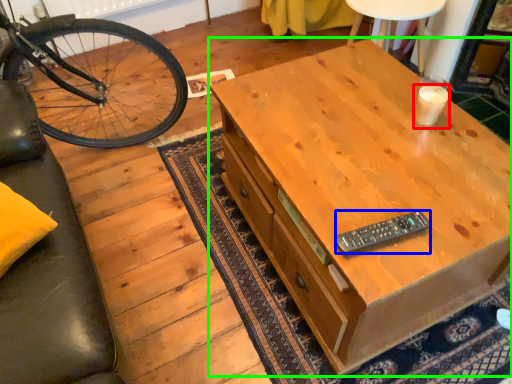
Question: Considering the real-world distances, which object is closest to coffee cup (highlighted by a red box)? remote control (highlighted by a blue box) or desk (highlighted by a green box).

Choices:
 (A) remote control
 (B) desk

Answer: (B)